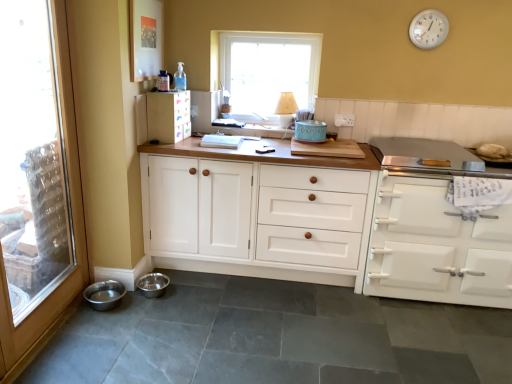
The height and width of the screenshot is (384, 512). What are the coordinates of `white plastic clock at upper right` in the screenshot? It's located at pyautogui.click(x=428, y=29).

What do you see at coordinates (268, 70) in the screenshot? I see `white frame window at upper center` at bounding box center [268, 70].

The width and height of the screenshot is (512, 384). What do you see at coordinates (437, 247) in the screenshot?
I see `white matte oven at right, arranged as the 1th cabinetry when viewed from the right` at bounding box center [437, 247].

The image size is (512, 384). Describe the element at coordinates (168, 116) in the screenshot. I see `matte white cabinet at upper left, the first cabinetry in the left-to-right sequence` at that location.

In order to click on white plastic clock at upper right in this screenshot , I will do `click(428, 29)`.

Is white frame window at upper center not close to white plastic clock at upper right?

white frame window at upper center is actually quite close to white plastic clock at upper right.

What's the angular difference between white frame window at upper center and white plastic clock at upper right's facing directions?

0.00185 degrees.

Is point (289, 70) closer to viewer compared to point (426, 31)?

No, (289, 70) is behind (426, 31).

Is white frame window at upper center turned away from white plastic clock at upper right?

white frame window at upper center does not have its back to white plastic clock at upper right.

Is matte white cabinet at upper left, positioned as the third cabinetry in right-to-left order, facing away from white matte oven at right, marked as the third cabinetry in a left-to-right arrangement?

No, matte white cabinet at upper left, positioned as the third cabinetry in right-to-left order, is not facing the opposite direction of white matte oven at right, marked as the third cabinetry in a left-to-right arrangement.

Consider the image. Does matte white cabinet at upper left, the first cabinetry in the left-to-right sequence, have a lesser width compared to white matte oven at right, arranged as the 1th cabinetry when viewed from the right?

Indeed, matte white cabinet at upper left, the first cabinetry in the left-to-right sequence, has a lesser width compared to white matte oven at right, arranged as the 1th cabinetry when viewed from the right.

Measure the distance between matte white cabinet at upper left, positioned as the third cabinetry in right-to-left order, and white matte oven at right, arranged as the 1th cabinetry when viewed from the right.

matte white cabinet at upper left, positioned as the third cabinetry in right-to-left order, is 5.53 feet from white matte oven at right, arranged as the 1th cabinetry when viewed from the right.

Between point (173, 126) and point (385, 216), which one is positioned behind?

Point (173, 126)

Find the location of a particular element. window lying behind the white wood cabinet at center, acting as the 2th cabinetry starting from the left is located at coordinates (268, 70).

How far apart are white frame window at upper center and white wood cabinet at center, acting as the 2th cabinetry starting from the left?

white frame window at upper center and white wood cabinet at center, acting as the 2th cabinetry starting from the left, are 1.03 meters apart from each other.

What's the angular difference between white frame window at upper center and white wood cabinet at center, acting as the 2th cabinetry starting from the left,'s facing directions?

They differ by 0.00364 degrees in their facing directions.

Considering the points (269, 61) and (296, 172), which point is behind, point (269, 61) or point (296, 172)?

The point (269, 61) is behind.

From a real-world perspective, is white matte oven at right, marked as the third cabinetry in a left-to-right arrangement, positioned under teal ceramic container at center based on gravity?

Yes, from a real-world perspective, white matte oven at right, marked as the third cabinetry in a left-to-right arrangement, is beneath teal ceramic container at center.

Can you confirm if white matte oven at right, arranged as the 1th cabinetry when viewed from the right, is wider than teal ceramic container at center?

Correct, the width of white matte oven at right, arranged as the 1th cabinetry when viewed from the right, exceeds that of teal ceramic container at center.

Is point (383, 243) farther from viewer compared to point (307, 139)?

No, (383, 243) is closer to viewer.

In the image, there is a white matte oven at right, marked as the third cabinetry in a left-to-right arrangement. At what (x,y) coordinates should I click in order to perform the action: click on lamp above it (from the image's perspective). Please return your answer as a coordinate pair (x, y). Looking at the image, I should click on (286, 109).

From the image's perspective, is wooden lampshade at upper center above white matte oven at right, marked as the third cabinetry in a left-to-right arrangement?

Yes, from the image's perspective, wooden lampshade at upper center is over white matte oven at right, marked as the third cabinetry in a left-to-right arrangement.

From the picture: Could you tell me if wooden lampshade at upper center is turned towards white matte oven at right, arranged as the 1th cabinetry when viewed from the right?

No, wooden lampshade at upper center is not turned towards white matte oven at right, arranged as the 1th cabinetry when viewed from the right.

Which object is wider, wooden lampshade at upper center or white matte oven at right, arranged as the 1th cabinetry when viewed from the right?

With larger width is white matte oven at right, arranged as the 1th cabinetry when viewed from the right.

Considering the relative positions of teal ceramic container at center and transparent glass door at left in the image provided, is teal ceramic container at center in front of transparent glass door at left?

No, teal ceramic container at center is behind transparent glass door at left.

Is teal ceramic container at center not within transparent glass door at left?

Indeed, teal ceramic container at center is completely outside transparent glass door at left.

I want to click on appliance located above the transparent glass door at left (from a real-world perspective), so click(x=310, y=131).

Considering the positions of point (312, 128) and point (77, 234), is point (312, 128) closer or farther from the camera than point (77, 234)?

Clearly, point (312, 128) is more distant from the camera than point (77, 234).

Could transparent glass door at left be considered to be inside white frame window at upper center?

No, transparent glass door at left is located outside of white frame window at upper center.

Based on the photo, is white frame window at upper center positioned far away from transparent glass door at left?

Indeed, white frame window at upper center is not near transparent glass door at left.

Is white frame window at upper center at the right side of transparent glass door at left?

Yes.

From a real-world perspective, which object rests below the other?

From a 3D spatial view, transparent glass door at left is below.

Find the location of a particular element. This screenshot has width=512, height=384. clock that appears in front of the white frame window at upper center is located at coordinates (428, 29).

From the image's perspective, count 2nd cabinetrys downward from the matte white cabinet at upper left, the first cabinetry in the left-to-right sequence, and point to it. Please provide its 2D coordinates.

[(437, 247)]

Which object lies nearer to the anchor point white frame window at upper center, white plastic clock at upper right or white matte oven at right, arranged as the 1th cabinetry when viewed from the right?

Based on the image, white plastic clock at upper right appears to be nearer to white frame window at upper center.

Estimate the real-world distances between objects in this image. Which object is further from teal ceramic container at center, white plastic clock at upper right or matte white cabinet at upper left, the first cabinetry in the left-to-right sequence?

Based on the image, white plastic clock at upper right appears to be further to teal ceramic container at center.

When comparing their distances from transparent glass door at left, does matte white cabinet at upper left, the first cabinetry in the left-to-right sequence, or white matte oven at right, arranged as the 1th cabinetry when viewed from the right, seem closer?

matte white cabinet at upper left, the first cabinetry in the left-to-right sequence, is closer to transparent glass door at left.

When comparing their distances from wooden lampshade at upper center, does teal ceramic container at center or white plastic clock at upper right seem closer?

teal ceramic container at center lies closer to wooden lampshade at upper center than the other object.

Considering their positions, is transparent glass door at left positioned closer to wooden lampshade at upper center than white wood cabinet at center, acting as the 2th cabinetry starting from the left?

white wood cabinet at center, acting as the 2th cabinetry starting from the left.

When comparing their distances from wooden lampshade at upper center, does teal ceramic container at center or white frame window at upper center seem further?

Among the two, white frame window at upper center is located further to wooden lampshade at upper center.

When comparing their distances from teal ceramic container at center, does transparent glass door at left or white frame window at upper center seem closer?

Based on the image, white frame window at upper center appears to be nearer to teal ceramic container at center.

Estimate the real-world distances between objects in this image. Which object is further from white frame window at upper center, white matte oven at right, arranged as the 1th cabinetry when viewed from the right, or transparent glass door at left?

transparent glass door at left lies further to white frame window at upper center than the other object.

Image resolution: width=512 pixels, height=384 pixels. What are the coordinates of `clock between transparent glass door at left and white matte oven at right, marked as the third cabinetry in a left-to-right arrangement` in the screenshot? It's located at (428, 29).

Identify the location of appliance situated between matte white cabinet at upper left, the first cabinetry in the left-to-right sequence, and white plastic clock at upper right from left to right. (310, 131).

Identify the location of appliance between transparent glass door at left and wooden lampshade at upper center in the front-back direction. (310, 131).

Where is `appliance between wooden lampshade at upper center and white plastic clock at upper right from left to right`? appliance between wooden lampshade at upper center and white plastic clock at upper right from left to right is located at coordinates (310, 131).